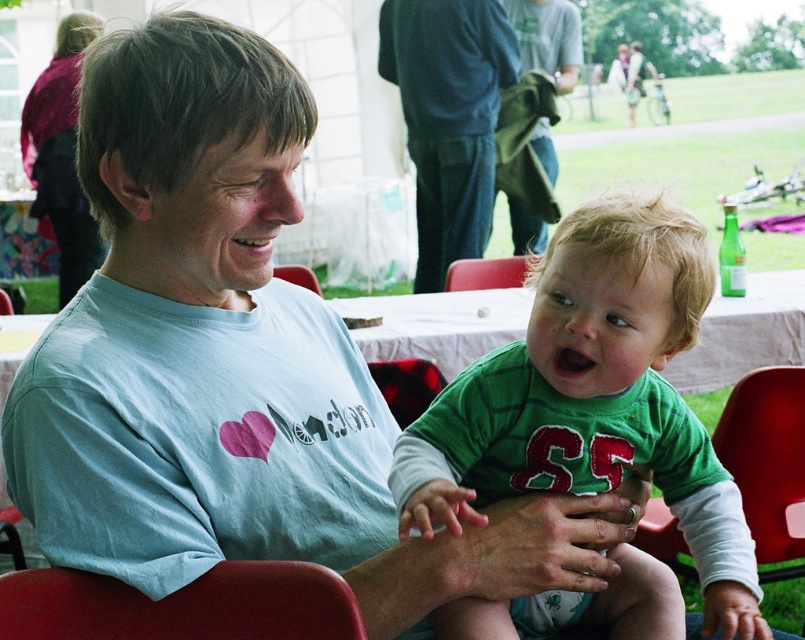
Question: Is green soft cotton shirt at center thinner than maroon fabric jacket at upper left?

Choices:
 (A) yes
 (B) no

Answer: (A)

Question: Can you confirm if red plastic chair at lower left is positioned below green cotton shirt at upper center?

Choices:
 (A) yes
 (B) no

Answer: (A)

Question: Does green soft cotton shirt at center have a smaller size compared to red plastic chair at lower left?

Choices:
 (A) no
 (B) yes

Answer: (A)

Question: Which point is closer to the camera?

Choices:
 (A) (67, 252)
 (B) (488, 266)

Answer: (B)

Question: Which object is the farthest from the red plastic chair at lower left?

Choices:
 (A) dark blue jeans at center
 (B) green cotton shirt at upper center

Answer: (B)

Question: Which point is closer to the camera?

Choices:
 (A) red plastic chair at lower left
 (B) maroon fabric jacket at upper left

Answer: (A)